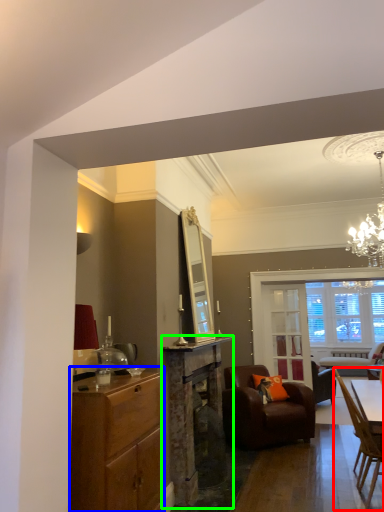
Question: Which is farther away from chair (highlighted by a red box)? cabinetry (highlighted by a blue box) or fireplace (highlighted by a green box)?

Choices:
 (A) cabinetry
 (B) fireplace

Answer: (A)